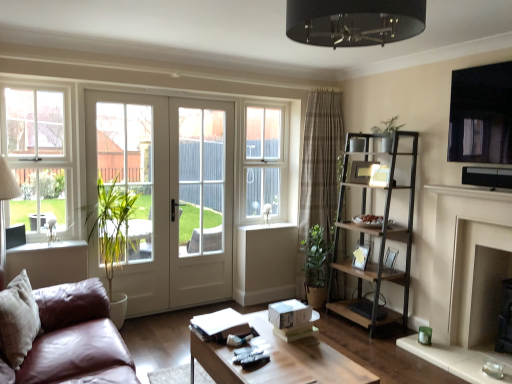
Image resolution: width=512 pixels, height=384 pixels. In order to click on free spot above white matte fireplace at right (from a real-world perspective) in this screenshot , I will do `click(485, 201)`.